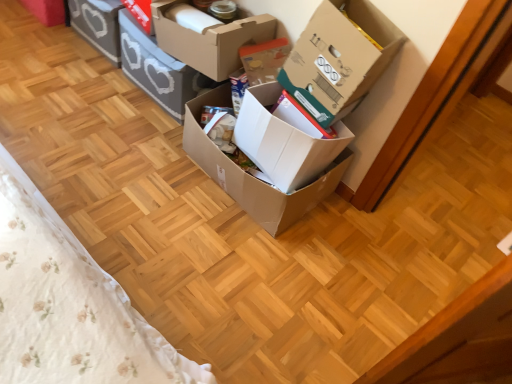
Question: Does point (337, 49) appear closer or farther from the camera than point (167, 92)?

Choices:
 (A) closer
 (B) farther

Answer: (A)

Question: From their relative heights in the image, would you say cardboard box at upper right, the 6th box viewed from the left, is taller or shorter than cardboard box at center, the second box in the left-to-right sequence?

Choices:
 (A) short
 (B) tall

Answer: (B)

Question: Estimate the real-world distances between objects in this image. Which object is farther from the matte gray storage box at upper left, which is the sixth box from right to left?

Choices:
 (A) cardboard box at center, which ranks as the third box in left-to-right order
 (B) cardboard box at center, the 5th box positioned from the right
 (C) brown cardboard box at center, marked as the 4th box in a left-to-right arrangement
 (D) cardboard box at upper right, which ranks as the 1th box in right-to-left order
 (E) cardboard box at center, placed as the second box when sorted from right to left

Answer: (D)

Question: Which object is the farthest from the cardboard box at center, which is the fourth box from right to left?

Choices:
 (A) brown cardboard box at center, the third box positioned from the right
 (B) cardboard box at upper right, which ranks as the 1th box in right-to-left order
 (C) cardboard box at center, arranged as the 5th box when viewed from the left
 (D) cardboard box at center, the second box in the left-to-right sequence
 (E) matte gray storage box at upper left, the first box positioned from the left

Answer: (E)